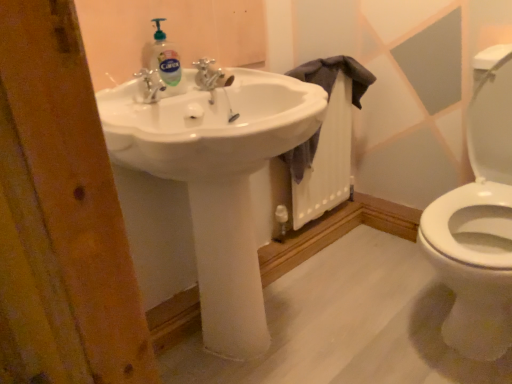
Question: From a real-world perspective, is dark gray fabric at sink above or below silver metallic faucet at center?

Choices:
 (A) above
 (B) below

Answer: (B)

Question: Would you say dark gray fabric at sink is to the left or to the right of silver metallic faucet at center in the picture?

Choices:
 (A) left
 (B) right

Answer: (B)

Question: Considering the real-world distances, which object is closest to the silver metallic faucet at center?

Choices:
 (A) white glossy sink at center
 (B) clear liquid soap at upper center
 (C) dark gray fabric at sink

Answer: (B)

Question: Estimate the real-world distances between objects in this image. Which object is closer to the dark gray fabric at sink?

Choices:
 (A) silver metallic faucet at center
 (B) white glossy sink at center
 (C) clear liquid soap at upper center

Answer: (A)